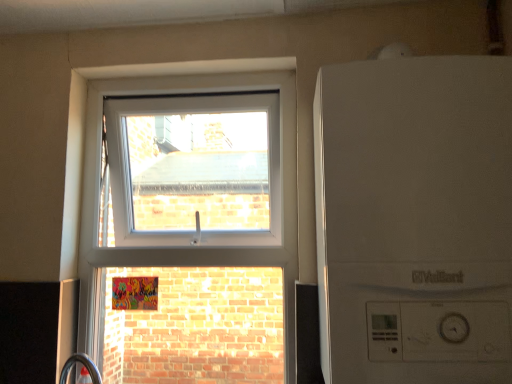
Question: Based on their sizes in the image, would you say transparent glass window at upper center is bigger or smaller than white matte boiler at upper center?

Choices:
 (A) big
 (B) small

Answer: (A)

Question: Considering the positions of transparent glass window at upper center and white matte boiler at upper center in the image, is transparent glass window at upper center taller or shorter than white matte boiler at upper center?

Choices:
 (A) short
 (B) tall

Answer: (B)

Question: In the image, is transparent glass window at upper center positioned in front of or behind white matte boiler at upper center?

Choices:
 (A) front
 (B) behind

Answer: (B)

Question: Is white matte boiler at upper center to the left or to the right of transparent glass window at upper center in the image?

Choices:
 (A) left
 (B) right

Answer: (B)

Question: Do you think white matte boiler at upper center is within transparent glass window at upper center, or outside of it?

Choices:
 (A) inside
 (B) outside

Answer: (B)

Question: From a real-world perspective, is white matte boiler at upper center above or below transparent glass window at upper center?

Choices:
 (A) above
 (B) below

Answer: (A)

Question: From their relative heights in the image, would you say white matte boiler at upper center is taller or shorter than transparent glass window at upper center?

Choices:
 (A) short
 (B) tall

Answer: (A)